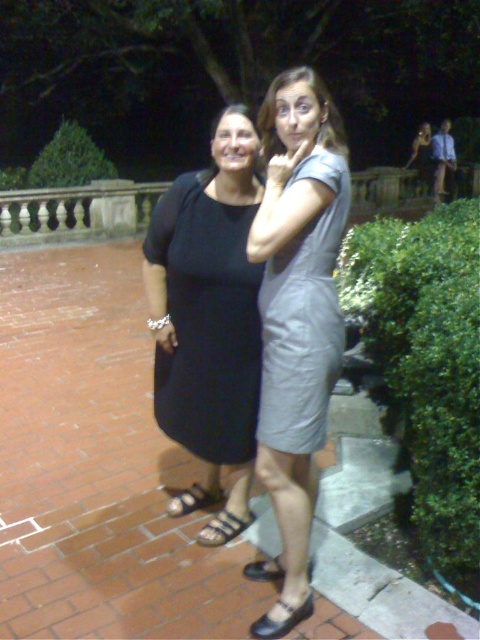
Question: Which point is farther to the camera?

Choices:
 (A) (164, 212)
 (B) (271, 324)

Answer: (A)

Question: Does black leather shoe at lower center have a larger size compared to black leather sandal at lower center?

Choices:
 (A) yes
 (B) no

Answer: (A)

Question: Can you confirm if black leather sandal at lower left is positioned above brown leather sandal at lower left?

Choices:
 (A) no
 (B) yes

Answer: (A)

Question: Which point is closer to the camera taking this photo?

Choices:
 (A) (240, 532)
 (B) (254, 278)
 (C) (444, 161)

Answer: (B)

Question: Is gray leather dress at center further to the viewer compared to blue denim shirt at upper right?

Choices:
 (A) yes
 (B) no

Answer: (B)

Question: Which object is closer to the camera taking this photo?

Choices:
 (A) black leather shoe at lower center
 (B) black matte dress at center

Answer: (A)